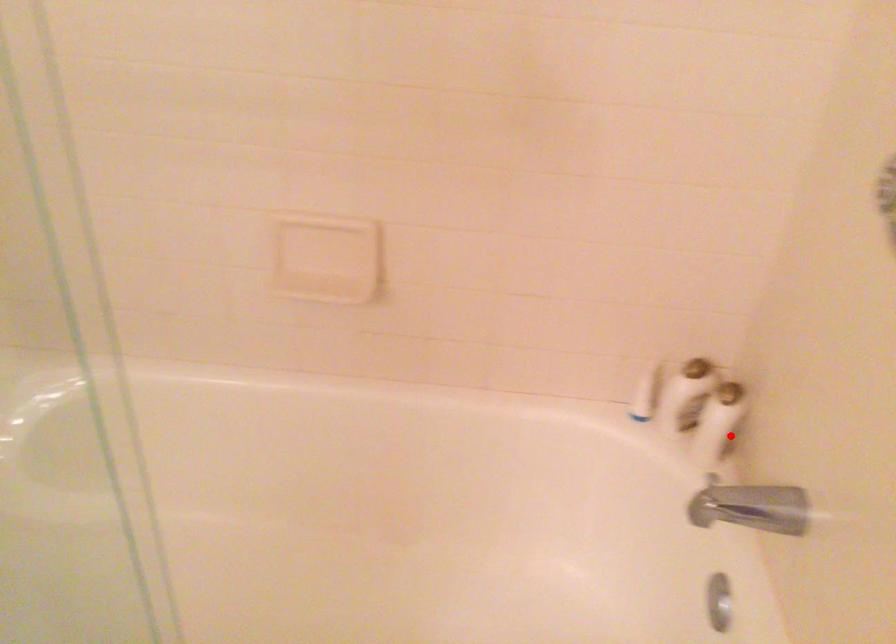
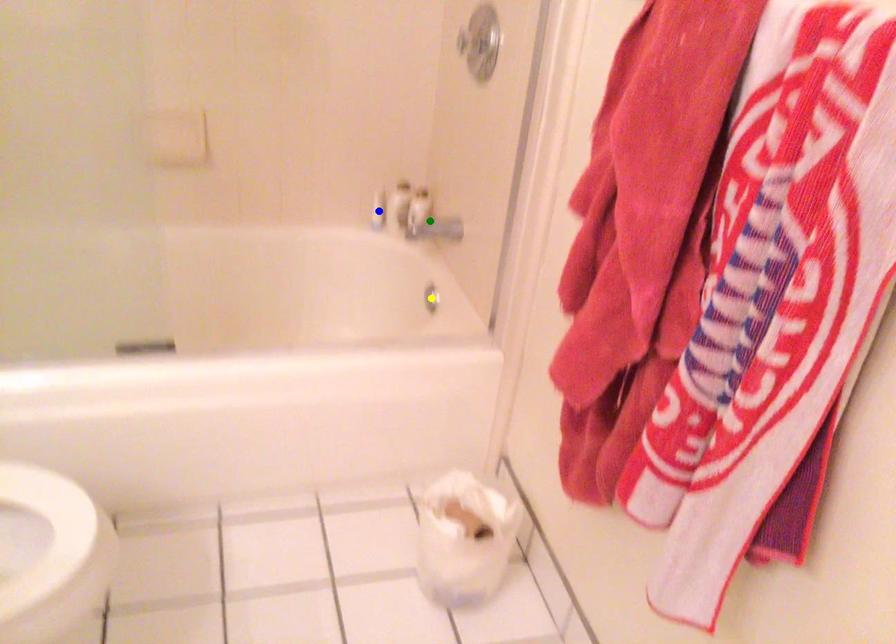
Question: I am providing you with two images of the same scene from different viewpoints. A red point is marked on the first image. You are given multiple points on the second image. Can you choose the point in image 2 that corresponds to the point in image 1?

Choices:
 (A) yellow point
 (B) green point
 (C) blue point

Answer: (B)